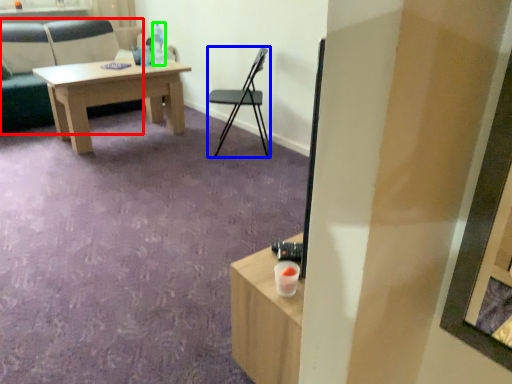
Question: Based on their relative distances, which object is nearer to chair (highlighted by a red box)? Choose from chair (highlighted by a blue box) and bottle (highlighted by a green box).

Choices:
 (A) chair
 (B) bottle

Answer: (B)